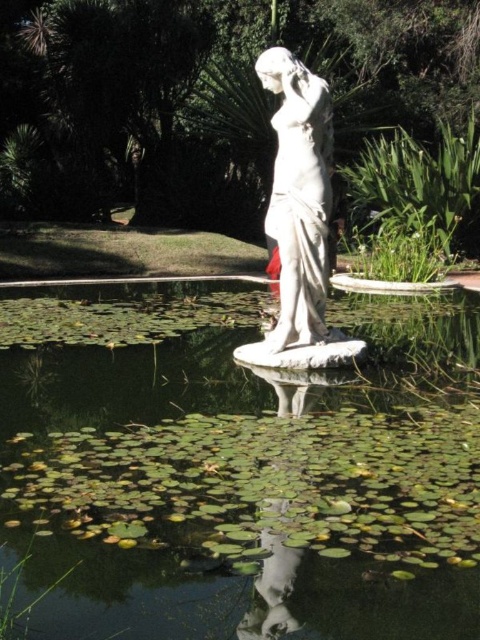
Is green lily pads at center bigger than white marble statue at center?

No.

Who is positioned more to the left, green lily pads at center or white marble statue at center?

From the viewer's perspective, green lily pads at center appears more on the left side.

Is point (361, 451) farther from camera compared to point (236, 348)?

No, it is not.

Identify the location of green lily pads at center. click(237, 468).